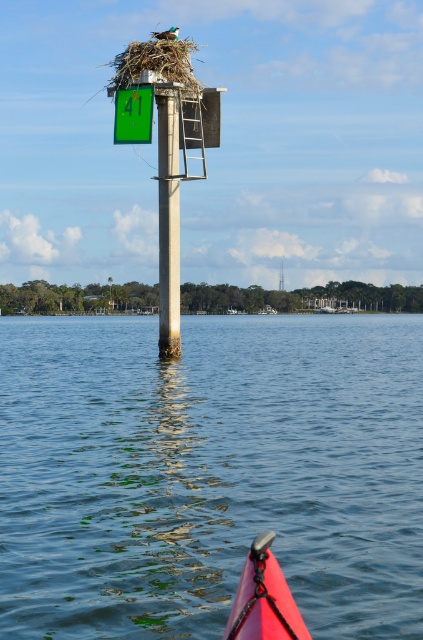
Can you confirm if blue water at center is bigger than rubberized pink kayak at lower center?

Yes, blue water at center is bigger than rubberized pink kayak at lower center.

Which is below, blue water at center or rubberized pink kayak at lower center?

rubberized pink kayak at lower center

Who is more distant from viewer, (36, 380) or (271, 577)?

Positioned behind is point (36, 380).

Identify the location of blue water at center. This screenshot has height=640, width=423. (208, 472).

Is point (159, 156) in front of point (272, 625)?

That is False.

Can you confirm if concrete pole at center is positioned above rubberized pink kayak at lower center?

Yes.

Between point (162, 125) and point (296, 620), which one is positioned in front?

Point (296, 620) is in front.

Find the location of a particular element. This screenshot has height=640, width=423. concrete pole at center is located at coordinates coord(167,218).

I want to click on blue water at center, so click(208, 472).

Is blue water at center to the left of concrete pole at center from the viewer's perspective?

Incorrect, blue water at center is not on the left side of concrete pole at center.

Where is `blue water at center`? blue water at center is located at coordinates (208, 472).

Find the location of `blue water at center`. blue water at center is located at coordinates (208, 472).